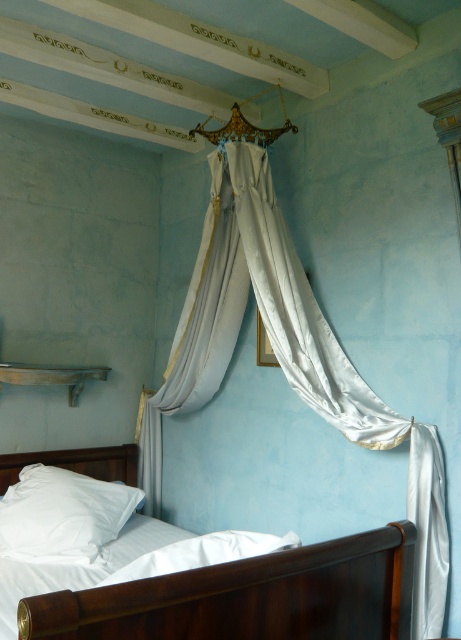
You are a GUI agent. You are given a task and a screenshot of the screen. Output one action in this format:
    pyautogui.click(x=<x>, y=<y>)
    Task: Click on the satin white bed at upper center
    This screenshot has width=461, height=640.
    Given the screenshot: What is the action you would take?
    pyautogui.click(x=248, y=596)

Who is more forward, (74, 458) or (68, 456)?

Point (68, 456) is more forward.

Image resolution: width=461 pixels, height=640 pixels. In order to click on satin white bed at upper center in this screenshot , I will do `click(248, 596)`.

Locate an element on the screen. The height and width of the screenshot is (640, 461). satin white bed at upper center is located at coordinates (248, 596).

Which is more to the right, satin white bed at upper center or white satin pillow at lower left?

satin white bed at upper center is more to the right.

Between point (213, 572) and point (111, 492), which one is positioned behind?

The point (111, 492) is behind.

Find the location of `satin white bed at upper center`. satin white bed at upper center is located at coordinates (248, 596).

Does white satin pillow at lower left have a greater height compared to white matte headboard at lower left?

Correct, white satin pillow at lower left is much taller as white matte headboard at lower left.

Which of these two, white satin pillow at lower left or white matte headboard at lower left, stands taller?

Standing taller between the two is white satin pillow at lower left.

You are a GUI agent. You are given a task and a screenshot of the screen. Output one action in this format:
    pyautogui.click(x=<x>, y=<y>)
    Task: Click on the white satin pillow at lower left
    The width and height of the screenshot is (461, 640).
    Given the screenshot: What is the action you would take?
    pyautogui.click(x=63, y=515)

Find the location of a particular element. This screenshot has height=640, width=461. white satin pillow at lower left is located at coordinates (63, 515).